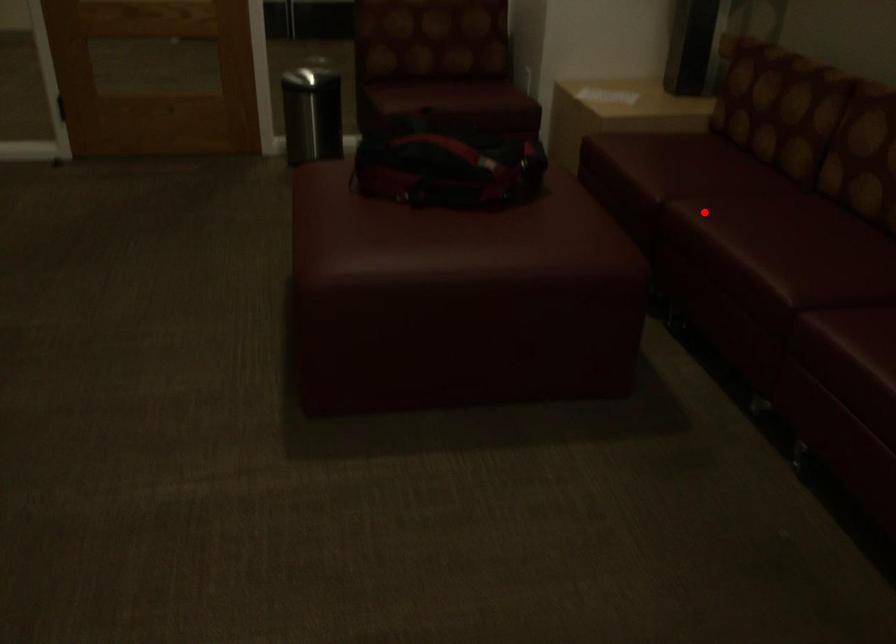
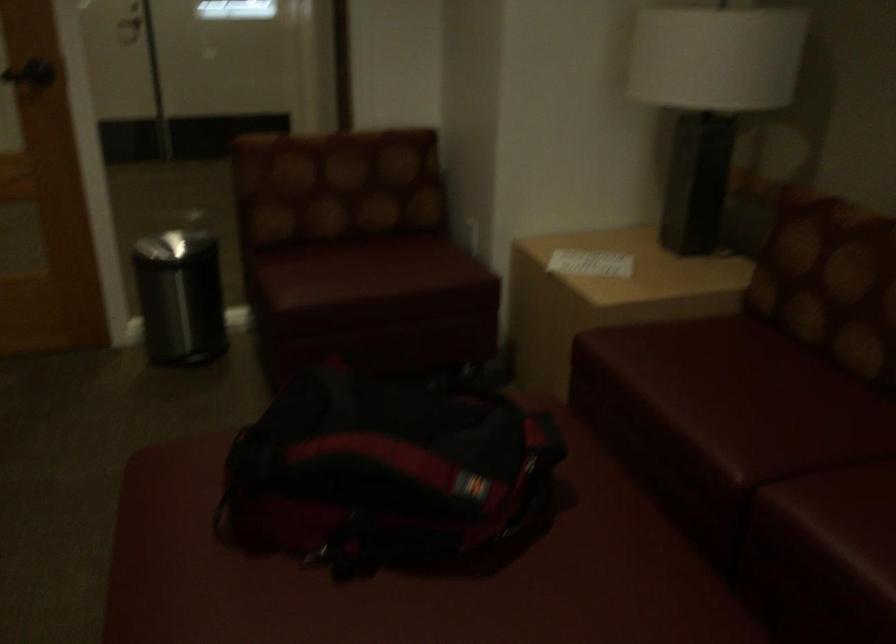
In the second image, find the point that corresponds to the highlighted location in the first image.

(834, 522)